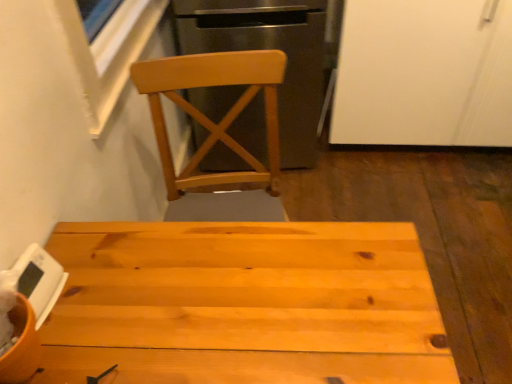
Where is `vacant area located to the right-hand side of white matte digital clock at lower left`? The height and width of the screenshot is (384, 512). vacant area located to the right-hand side of white matte digital clock at lower left is located at coordinates (120, 292).